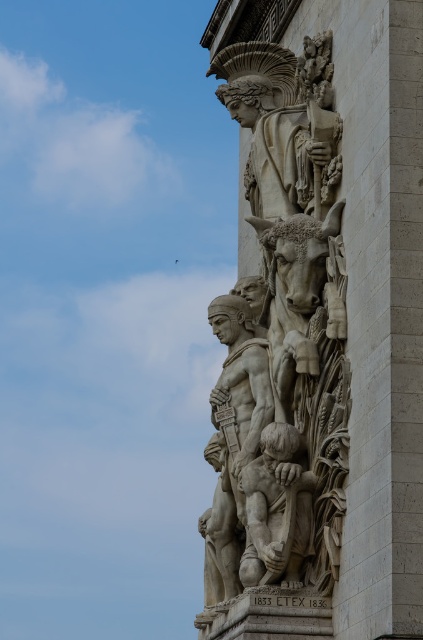
Question: Is white stone sculpture at center above matte stone child at center?

Choices:
 (A) yes
 (B) no

Answer: (A)

Question: Does white stone sculpture at center have a lesser width compared to matte stone child at center?

Choices:
 (A) yes
 (B) no

Answer: (B)

Question: Is white stone sculpture at center below matte stone child at center?

Choices:
 (A) yes
 (B) no

Answer: (B)

Question: Which point is closer to the camera?

Choices:
 (A) (337, 227)
 (B) (286, 426)

Answer: (B)

Question: Which point is closer to the camera?

Choices:
 (A) white stone sculpture at center
 (B) matte stone child at center

Answer: (A)